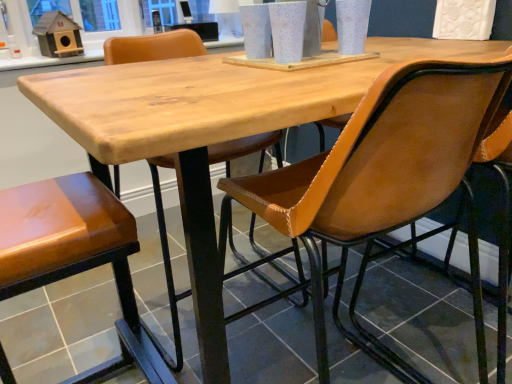
Question: From a real-world perspective, is glossy brown leather chair at lower left, positioned as the 2th chair in right-to-left order, positioned above or below brown leather chair at center, arranged as the first chair when viewed from the right?

Choices:
 (A) below
 (B) above

Answer: (A)

Question: Is glossy brown leather chair at lower left, positioned as the first chair in left-to-right order, spatially inside brown leather chair at center, which ranks as the 2th chair in left-to-right order, or outside of it?

Choices:
 (A) outside
 (B) inside

Answer: (A)

Question: Looking at their shapes, would you say glossy brown leather chair at lower left, positioned as the first chair in left-to-right order, is wider or thinner than brown leather chair at center, arranged as the first chair when viewed from the right?

Choices:
 (A) thin
 (B) wide

Answer: (A)

Question: Is brown leather chair at center, which ranks as the 2th chair in left-to-right order, situated inside glossy brown leather chair at lower left, positioned as the first chair in left-to-right order, or outside?

Choices:
 (A) outside
 (B) inside

Answer: (A)

Question: In terms of height, does brown leather chair at center, arranged as the first chair when viewed from the right, look taller or shorter compared to glossy brown leather chair at lower left, positioned as the first chair in left-to-right order?

Choices:
 (A) short
 (B) tall

Answer: (B)

Question: Is brown leather chair at center, which ranks as the 2th chair in left-to-right order, bigger or smaller than glossy brown leather chair at lower left, positioned as the first chair in left-to-right order?

Choices:
 (A) small
 (B) big

Answer: (B)

Question: From the image's perspective, is brown leather chair at center, arranged as the first chair when viewed from the right, positioned above or below glossy brown leather chair at lower left, positioned as the first chair in left-to-right order?

Choices:
 (A) below
 (B) above

Answer: (B)